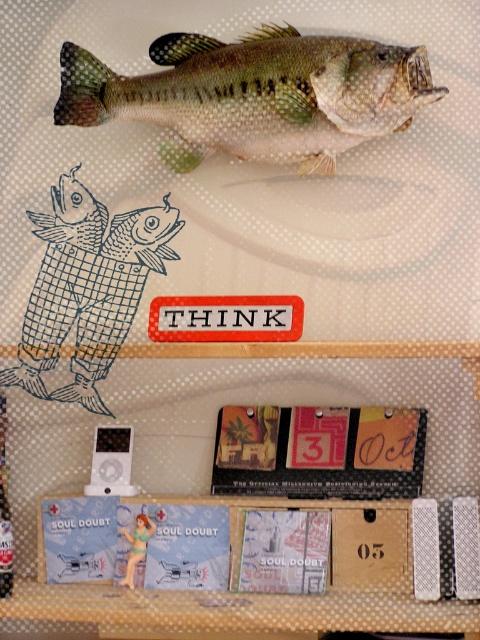
You are examining a collage with two points marked. The first point is at coordinates point (99,209) and the second is at point (215,627). Which point is closer to you?

Point (99,209) is closer to you because it is further to the viewer than point (215,627).

You are an observer looking at the image. You want to place a small sticker on the wooden box at center without covering the blue checkered fish at upper left. Is this possible?

The wooden box at center is behind the blue checkered fish at upper left, so placing a sticker on the wooden box at center would require placing it behind the blue checkered fish at upper left. Since the blue checkered fish is in front, you can place the sticker on the wooden box at center without covering it as long as the sticker is placed in the visible area of the wooden box not obscured by the fish.

You are an art curator arranging a display. You have a blue checkered fish at upper left and a matte plastic figurine at center. Which object is placed higher in the image?

The blue checkered fish at upper left is positioned over the matte plastic figurine at center, meaning it is placed higher in the image.